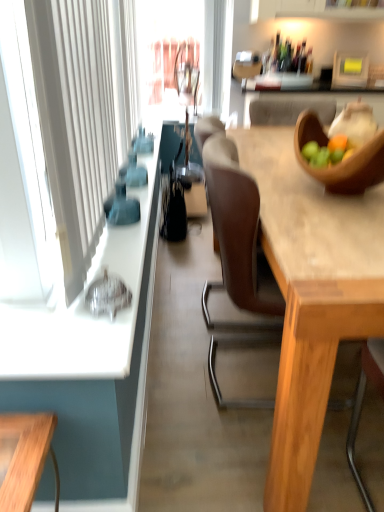
At what (x,y) coordinates should I click in order to perform the action: click on unoccupied area in front of black leather handbag at center. Please return your answer as a coordinate pair (x, y). The width and height of the screenshot is (384, 512). Looking at the image, I should click on [185, 243].